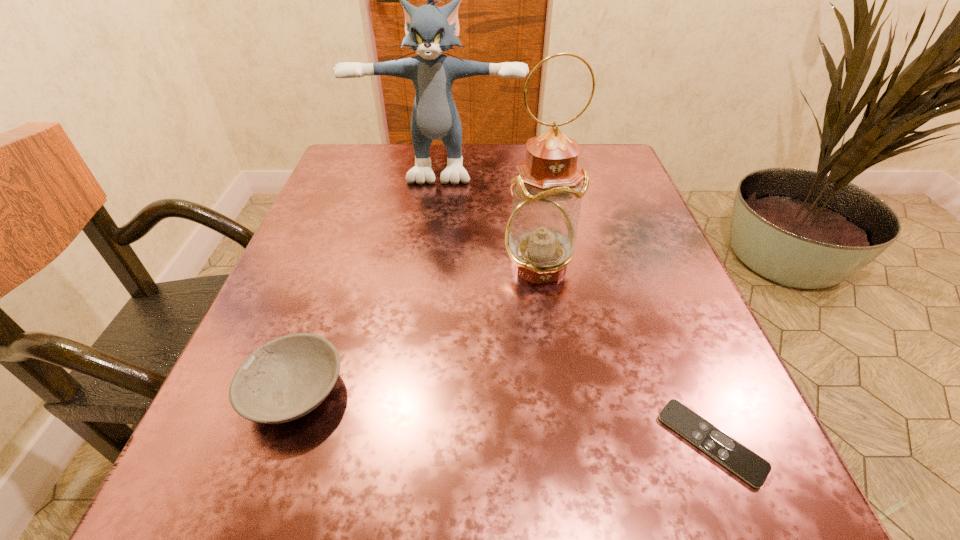
Where is `free spot between the shortest object and the cat`? free spot between the shortest object and the cat is located at coordinates (576, 303).

At what (x,y) coordinates should I click in order to perform the action: click on free spot between the bowl and the cat. Please return your answer as a coordinate pair (x, y). The width and height of the screenshot is (960, 540). Looking at the image, I should click on (368, 278).

Image resolution: width=960 pixels, height=540 pixels. What are the coordinates of `object identified as the closest to the cat` in the screenshot? It's located at 540,238.

Identify the location of object that stands as the third closest to the shortest object. (430, 30).

Where is `free space that satisfies the following two spatial constraints: 1. on the front-facing side of the rightmost object; 2. on the right side of the farthest object`? The width and height of the screenshot is (960, 540). free space that satisfies the following two spatial constraints: 1. on the front-facing side of the rightmost object; 2. on the right side of the farthest object is located at coordinates (404, 442).

Locate an element on the screen. The height and width of the screenshot is (540, 960). vacant region that satisfies the following two spatial constraints: 1. on the front-facing side of the farthest object; 2. on the right side of the third nearest object is located at coordinates (427, 266).

Identify the location of vacant space that satisfies the following two spatial constraints: 1. on the front-facing side of the cat; 2. on the right side of the remote control. The image size is (960, 540). (404, 442).

Locate an element on the screen. The width and height of the screenshot is (960, 540). free point that satisfies the following two spatial constraints: 1. on the front-facing side of the farthest object; 2. on the left side of the remote control is located at coordinates (404, 442).